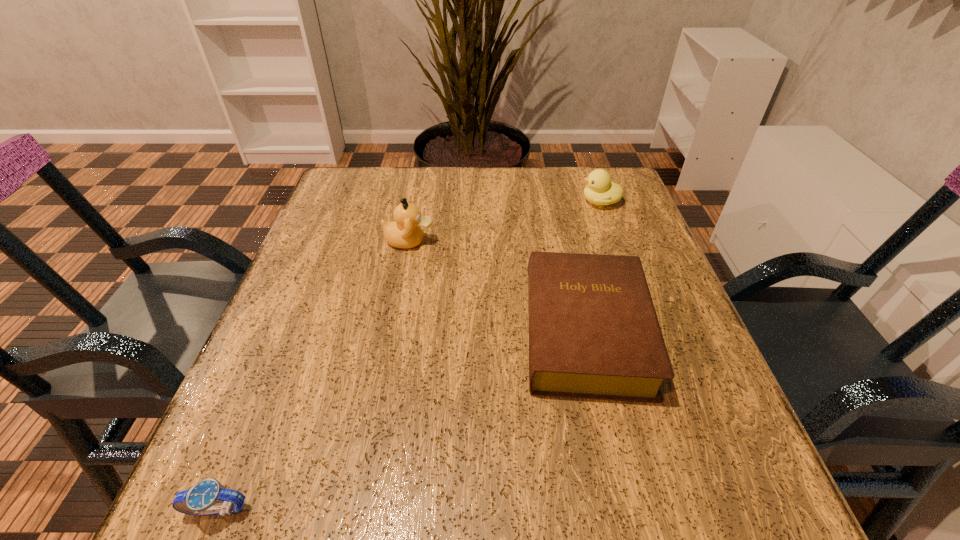
At what (x,y) coordinates should I click in order to perform the action: click on free space between the Bible and the shortest object. Please return your answer as a coordinate pair (x, y). Looking at the image, I should click on (401, 421).

The width and height of the screenshot is (960, 540). What are the coordinates of `empty space between the left duckling and the shortest object` in the screenshot? It's located at (314, 376).

This screenshot has width=960, height=540. I want to click on free spot between the shortest object and the left duckling, so click(314, 376).

This screenshot has height=540, width=960. Find the location of `free spot between the watch and the second shortest object`. free spot between the watch and the second shortest object is located at coordinates (401, 421).

The height and width of the screenshot is (540, 960). I want to click on free space between the second tallest object and the leftmost object, so pos(409,356).

Where is `unoccupied area between the right duckling and the taller duckling`? The height and width of the screenshot is (540, 960). unoccupied area between the right duckling and the taller duckling is located at coordinates (505, 221).

Locate an element on the screen. This screenshot has width=960, height=540. free point between the nearer duckling and the nearest object is located at coordinates (314, 376).

Where is `object that can be found as the second closest to the nearest object`? object that can be found as the second closest to the nearest object is located at coordinates (405, 232).

I want to click on object that is the second closest to the tallest object, so click(x=600, y=191).

Identify the location of free space that satisfies the following two spatial constraints: 1. on the back side of the second shortest object; 2. on the left side of the nearest object. (290, 332).